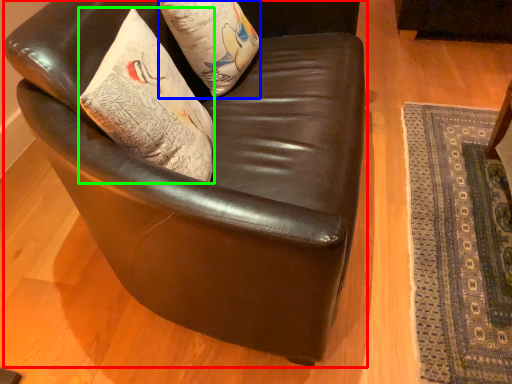
Question: Which object is the closest to the chair (highlighted by a red box)? Choose among these: pillow (highlighted by a blue box) or throw pillow (highlighted by a green box).

Choices:
 (A) pillow
 (B) throw pillow

Answer: (B)